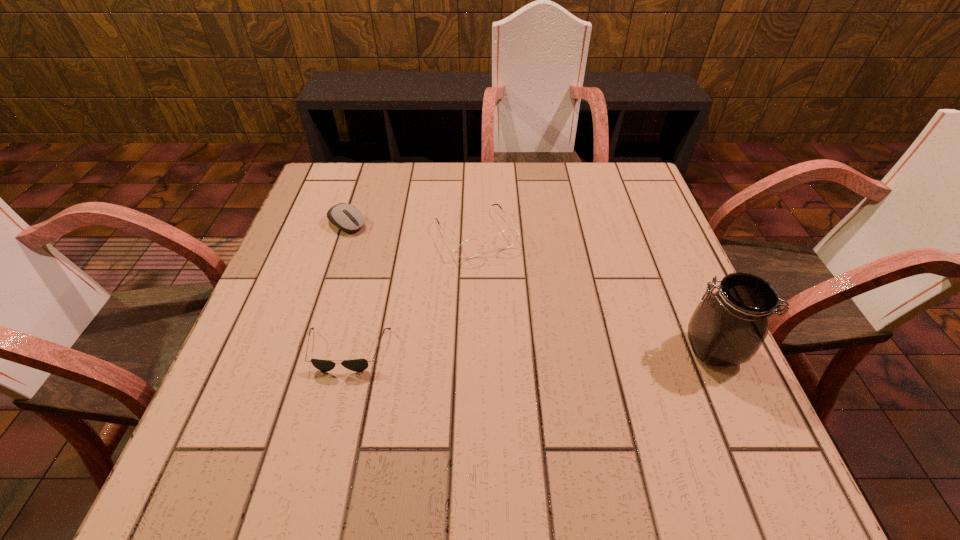
Image resolution: width=960 pixels, height=540 pixels. What are the coordinates of `object that is at the right edge` in the screenshot? It's located at (728, 327).

Locate an element on the screen. object positioned at the far left corner is located at coordinates (348, 218).

Where is `vacant region at the far edge`? This screenshot has width=960, height=540. vacant region at the far edge is located at coordinates (388, 186).

Identify the location of free space at the left edge of the desktop. (326, 222).

You are a GUI agent. You are given a task and a screenshot of the screen. Output one action in this format:
    pyautogui.click(x=<x>, y=<y>)
    Task: Click on the blank space at the right edge of the desktop
    
    Given the screenshot: What is the action you would take?
    pyautogui.click(x=652, y=373)

This screenshot has height=540, width=960. Identify the location of free space at the far left corner of the desktop. (313, 186).

You are a GUI agent. You are given a task and a screenshot of the screen. Output one action in this format:
    pyautogui.click(x=<x>, y=<y>)
    Task: Click on the free space at the far right corner of the desktop
    The width and height of the screenshot is (960, 540).
    Given the screenshot: What is the action you would take?
    pyautogui.click(x=633, y=185)

This screenshot has height=540, width=960. I want to click on vacant space that's between the second object from right to left and the sunglasses, so click(412, 292).

Identify the location of blank region between the sunglasses and the computer equipment. (348, 287).

Where is `empty space between the jar and the third shortest object`? empty space between the jar and the third shortest object is located at coordinates (594, 291).